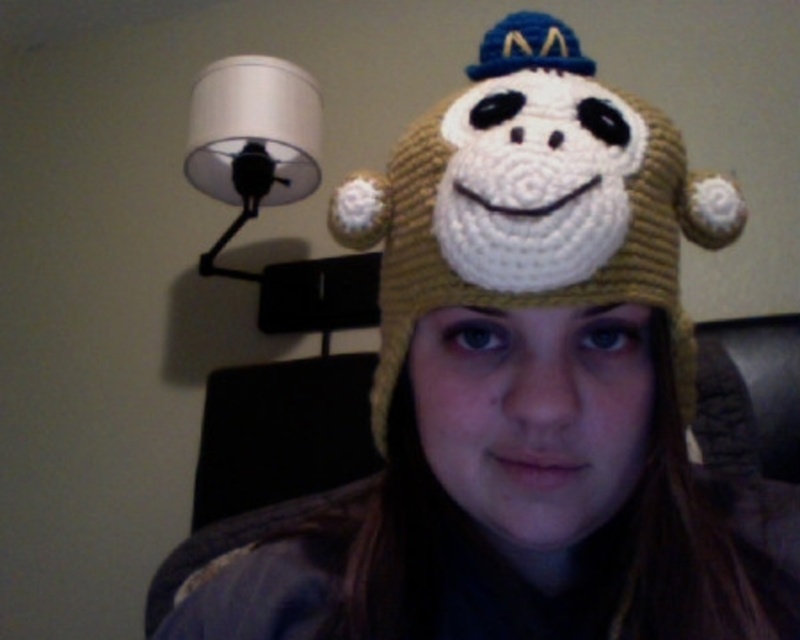
You are a tailor measuring items for a display case. The display case has a maximum width capacity of 30 cm. You need to place both the yarn knitted hat at center and the white matte lampshade at upper left inside. Given their widths, can both items fit side by side without exceeding the display case width?

The yarn knitted hat at center has a smaller width than the white matte lampshade at upper left. However, without knowing the exact widths of both items, it is impossible to determine if their combined width exceeds the 30 cm limit. Additional measurements are required.